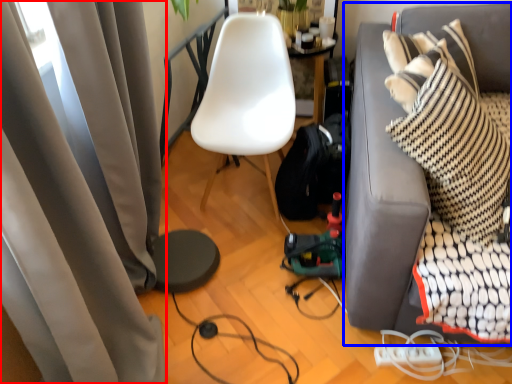
Question: Among these objects, which one is nearest to the camera, curtain (highlighted by a red box) or studio couch (highlighted by a blue box)?

Choices:
 (A) curtain
 (B) studio couch

Answer: (A)